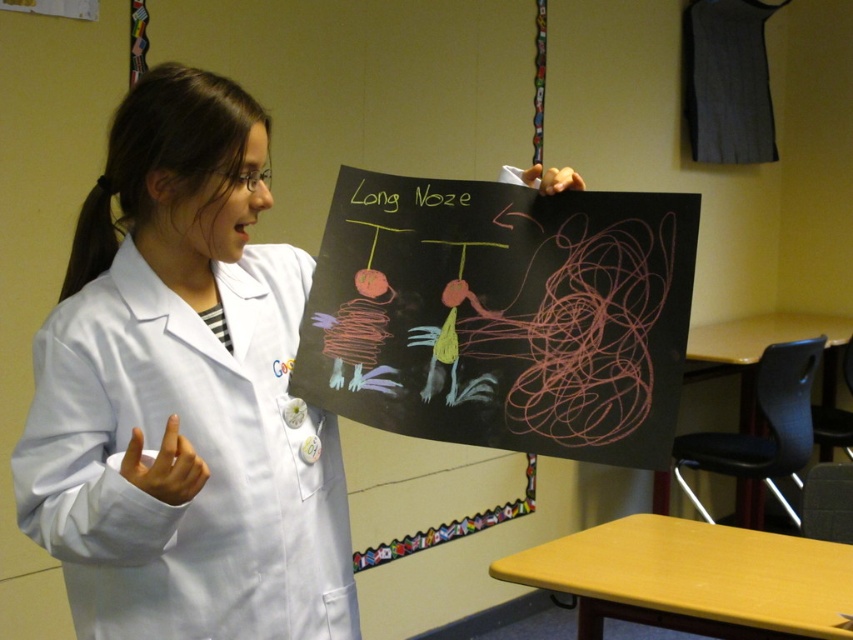
Can you confirm if white smooth lab coat at center is positioned above green chalk writing at upper center?

No, white smooth lab coat at center is not above green chalk writing at upper center.

Locate an element on the screen. Image resolution: width=853 pixels, height=640 pixels. white smooth lab coat at center is located at coordinates (196, 454).

Does white lab coat at center have a smaller size compared to white smooth lab coat at center?

No.

The width and height of the screenshot is (853, 640). Describe the element at coordinates (184, 394) in the screenshot. I see `white lab coat at center` at that location.

Does point (291, 536) lie in front of point (77, 346)?

No, (291, 536) is behind (77, 346).

At what (x,y) coordinates should I click in order to perform the action: click on white lab coat at center. Please return your answer as a coordinate pair (x, y). Looking at the image, I should click on (184, 394).

Can you confirm if white lab coat at center is smaller than green chalk writing at upper center?

Actually, white lab coat at center might be larger than green chalk writing at upper center.

The height and width of the screenshot is (640, 853). I want to click on white lab coat at center, so click(x=184, y=394).